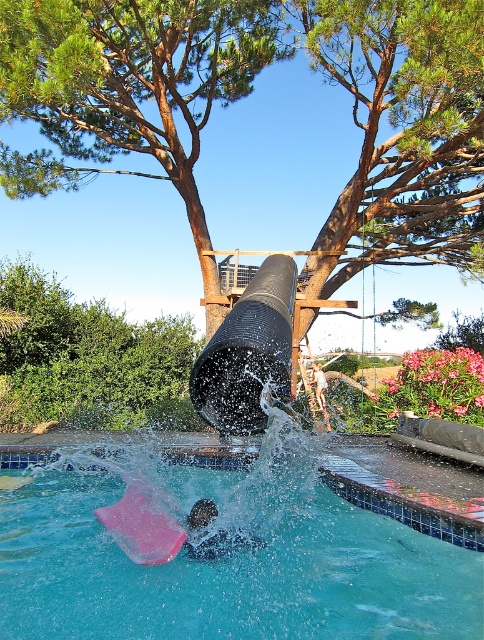
Question: Which point appears closest to the camera in this image?

Choices:
 (A) (6, 472)
 (B) (132, 545)
 (C) (198, 529)
 (D) (418, 200)

Answer: (C)

Question: Is green leafy tree at upper center positioned in front of dark matte swim cap at lower center?

Choices:
 (A) no
 (B) yes

Answer: (B)

Question: Can you confirm if brown wood tree at upper center is positioned above pink rubber slide at lower center?

Choices:
 (A) yes
 (B) no

Answer: (A)

Question: Does green leafy tree at upper center appear on the right side of black rubber tube at center?

Choices:
 (A) no
 (B) yes

Answer: (A)

Question: Estimate the real-world distances between objects in this image. Which object is closer to the black rubber tube at center?

Choices:
 (A) brown wood tree at upper center
 (B) transparent plastic pool at center
 (C) green leafy tree at upper center

Answer: (B)

Question: Estimate the real-world distances between objects in this image. Which object is closer to the pink rubber slide at lower center?

Choices:
 (A) green leafy tree at upper center
 (B) transparent plastic pool at center
 (C) black rubber tube at center
 (D) dark matte swim cap at lower center

Answer: (D)